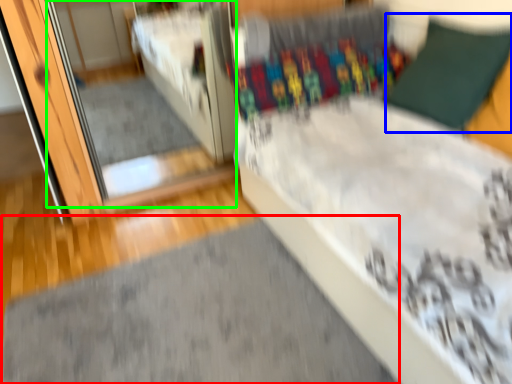
Question: Which is nearer to the doormat (highlighted by a red box)? pillow (highlighted by a blue box) or mirror (highlighted by a green box).

Choices:
 (A) pillow
 (B) mirror

Answer: (A)